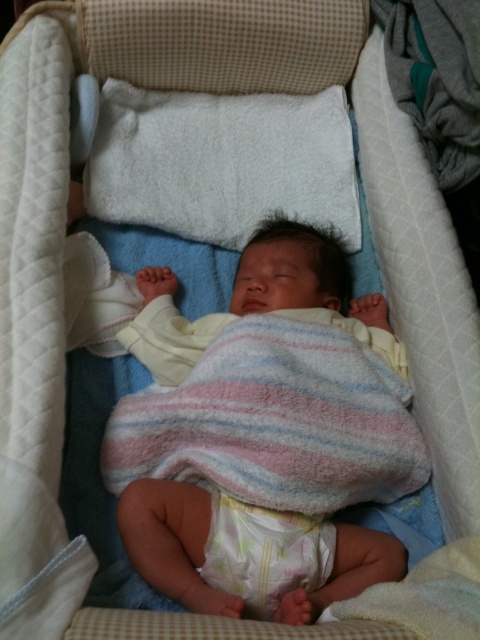
Question: Considering the relative positions of soft cotton blanket at center and white soft diaper at center in the image provided, where is soft cotton blanket at center located with respect to white soft diaper at center?

Choices:
 (A) below
 (B) above

Answer: (B)

Question: Is soft cotton blanket at center below white soft diaper at center?

Choices:
 (A) no
 (B) yes

Answer: (A)

Question: Which point is closer to the camera?

Choices:
 (A) white soft diaper at center
 (B) soft cotton blanket at center

Answer: (B)

Question: Does soft cotton blanket at center appear under white soft diaper at center?

Choices:
 (A) no
 (B) yes

Answer: (A)

Question: Which point is farther to the camera?

Choices:
 (A) soft cotton blanket at center
 (B) white soft diaper at center

Answer: (B)